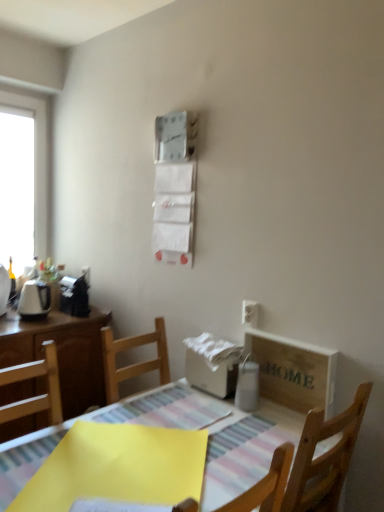
Where is `vacant region to the left of wooden crate at lower right`? Image resolution: width=384 pixels, height=512 pixels. vacant region to the left of wooden crate at lower right is located at coordinates (235, 417).